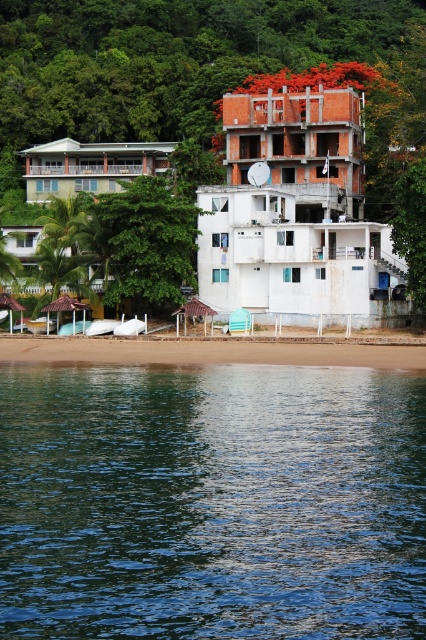
Question: Where is white concrete building at upper center located in relation to white matte building at center in the image?

Choices:
 (A) right
 (B) left

Answer: (A)

Question: Is white concrete building at upper center positioned in front of white matte building at center?

Choices:
 (A) yes
 (B) no

Answer: (A)

Question: Can you confirm if white concrete building at upper center is thinner than white matte building at center?

Choices:
 (A) no
 (B) yes

Answer: (B)

Question: Estimate the real-world distances between objects in this image. Which object is farther from the white concrete building at upper center?

Choices:
 (A) clear blue water at lower center
 (B) brown sand at lower center
 (C) white matte building at center

Answer: (A)

Question: Among these objects, which one is farthest from the camera?

Choices:
 (A) white concrete building at upper center
 (B) white matte building at center

Answer: (B)

Question: Among these points, which one is farthest from the camera?

Choices:
 (A) (423, 508)
 (B) (244, 186)
 (C) (40, 148)

Answer: (C)